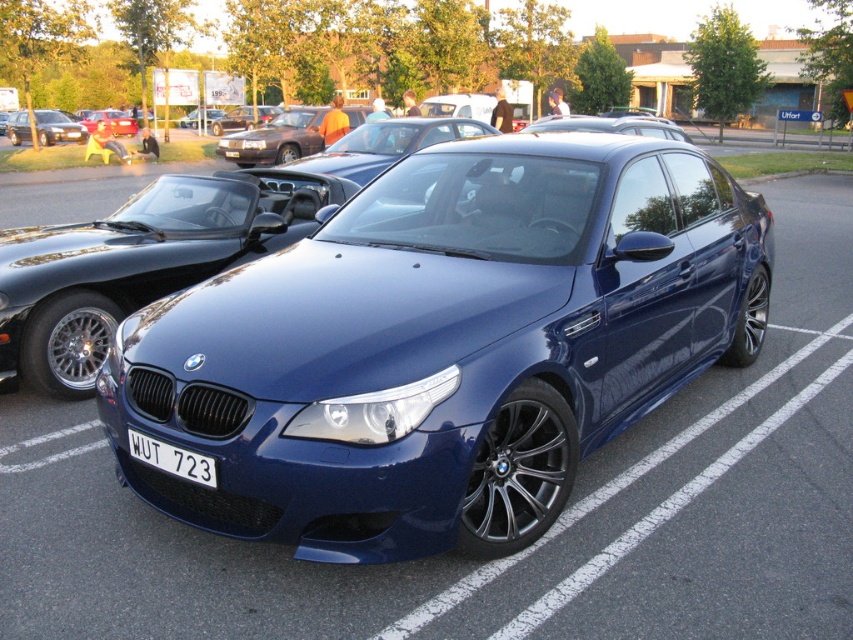
Is satin blue car at center bigger than white plastic license plate at center?

Incorrect, satin blue car at center is not larger than white plastic license plate at center.

What do you see at coordinates (374, 148) in the screenshot?
I see `satin blue car at center` at bounding box center [374, 148].

Who is more distant from viewer, (x=321, y=168) or (x=212, y=472)?

The point (x=321, y=168) is behind.

Identify the location of satin blue car at center. (374, 148).

Is point (155, 438) more distant than point (103, 116)?

No, it is in front of (103, 116).

Is point (155, 456) closer to camera compared to point (88, 128)?

Yes, point (155, 456) is in front of point (88, 128).

Is point (138, 460) closer to viewer compared to point (128, 115)?

That is True.

This screenshot has height=640, width=853. Find the location of `white plastic license plate at center`. white plastic license plate at center is located at coordinates (172, 458).

Can you confirm if satin blue car at center is shorter than matte black sedan at left?

Yes.

Consider the image. Which is more to the right, satin blue car at center or matte black sedan at left?

Positioned to the right is satin blue car at center.

Between point (358, 144) and point (10, 138), which one is positioned behind?

Positioned behind is point (10, 138).

At what (x,y) coordinates should I click in order to perform the action: click on satin blue car at center. Please return your answer as a coordinate pair (x, y). Looking at the image, I should click on (374, 148).